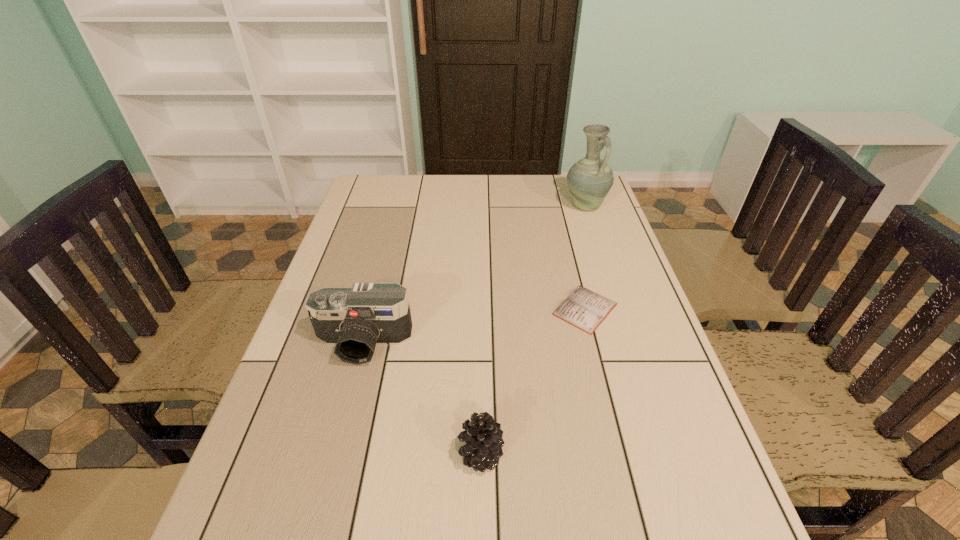
Identify the location of object at the far edge. (589, 180).

The width and height of the screenshot is (960, 540). Find the location of `object that is positioned at the left edge`. object that is positioned at the left edge is located at coordinates (355, 319).

You are a GUI agent. You are given a task and a screenshot of the screen. Output one action in this format:
    pyautogui.click(x=<x>, y=<y>)
    Task: Click on the pitcher present at the right edge
    This screenshot has height=540, width=960.
    Given the screenshot: What is the action you would take?
    pyautogui.click(x=589, y=180)

Locate an element on the screen. This screenshot has width=960, height=540. diary positioned at the right edge is located at coordinates (584, 309).

Locate an element on the screen. This screenshot has width=960, height=540. object located at the far right corner is located at coordinates (589, 180).

Identify the location of free space at the far edge of the desktop. This screenshot has width=960, height=540. (558, 200).

Locate an element on the screen. The width and height of the screenshot is (960, 540). vacant space at the left edge of the desktop is located at coordinates (277, 485).

Where is `vacant space at the right edge of the desktop`? vacant space at the right edge of the desktop is located at coordinates (612, 377).

This screenshot has width=960, height=540. I want to click on free space at the far left corner of the desktop, so click(362, 186).

In order to click on vacant space at the far right corner of the desktop in this screenshot , I will do `click(566, 198)`.